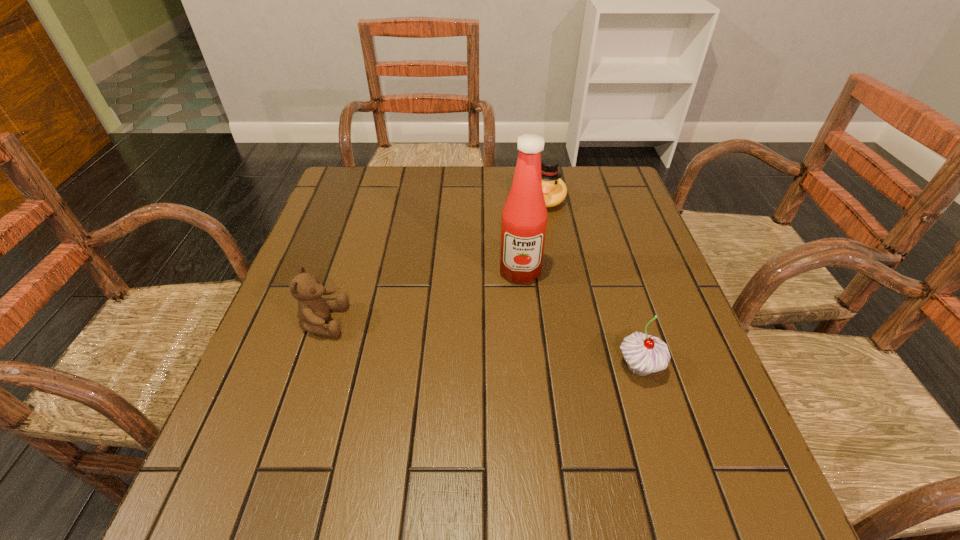
Identify the location of vacant space on the desktop that is between the leftmost object and the rightmost object and is positioned on the front-facing side of the duck. Image resolution: width=960 pixels, height=540 pixels. (492, 346).

You are a GUI agent. You are given a task and a screenshot of the screen. Output one action in this format:
    pyautogui.click(x=<x>, y=<y>)
    Task: Click on the free space on the desktop that is between the leftmost object and the rightmost object and is positioned on the front-facing side of the tallest object
    
    Given the screenshot: What is the action you would take?
    pyautogui.click(x=519, y=350)